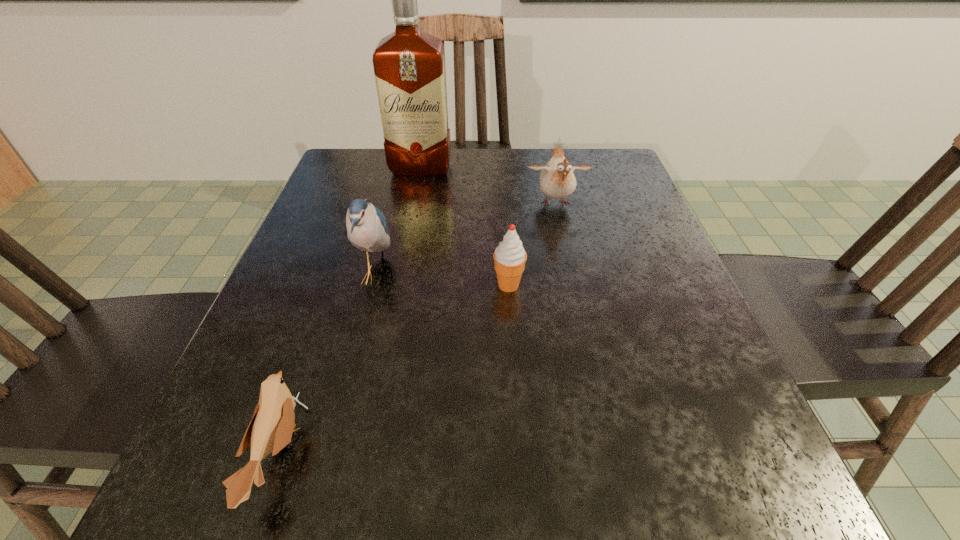
Locate an element on the screen. vacant position located at the tip of the second tallest object's beak is located at coordinates (606, 275).

You are a GUI agent. You are given a task and a screenshot of the screen. Output one action in this format:
    pyautogui.click(x=<x>, y=<y>)
    Task: Click on the free space located 0.100m at the beak of the rightmost object
    
    Given the screenshot: What is the action you would take?
    pyautogui.click(x=565, y=248)

At what (x,y) coordinates should I click in order to perform the action: click on vacant space located on the back of the icecream. Please return your answer as a coordinate pair (x, y). This screenshot has height=540, width=960. Looking at the image, I should click on click(502, 186).

Where is `vacant space located 0.210m at the beak of the leftmost bird`? vacant space located 0.210m at the beak of the leftmost bird is located at coordinates (461, 455).

Locate an element on the screen. Image resolution: width=960 pixels, height=540 pixels. liquor at the far edge is located at coordinates (409, 65).

Find the location of a particular element. This screenshot has width=960, height=540. bird that is at the far edge is located at coordinates (557, 180).

Identify the location of object that is at the near edge. (270, 430).

At what (x,y) coordinates should I click in order to perform the action: click on liquor at the left edge. Please return your answer as a coordinate pair (x, y). The image size is (960, 540). Looking at the image, I should click on (409, 65).

In order to click on object located at the right edge in this screenshot , I will do `click(557, 180)`.

The height and width of the screenshot is (540, 960). In order to click on object at the far left corner in this screenshot , I will do `click(409, 65)`.